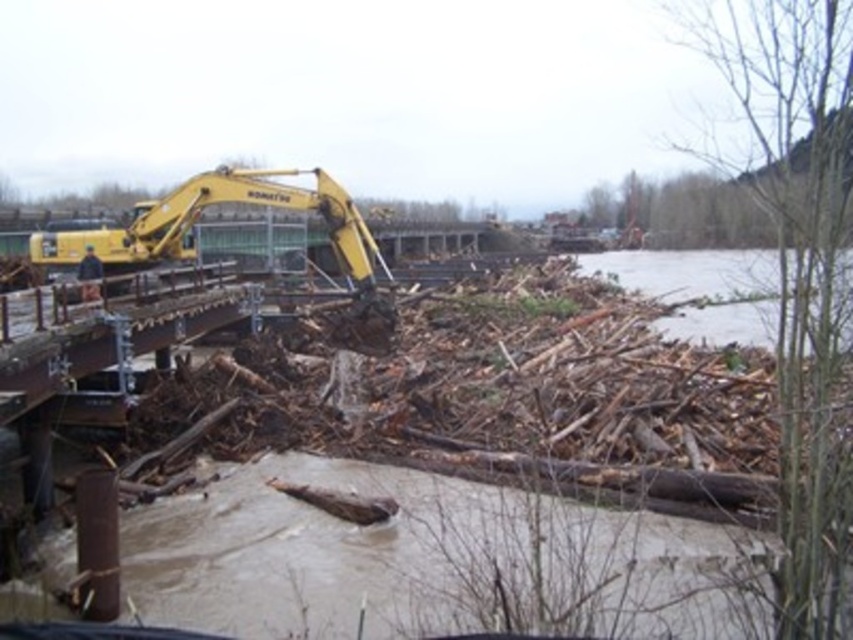
Question: Which point appears farthest from the camera in this image?

Choices:
 (A) (744, 321)
 (B) (386, 438)

Answer: (A)

Question: Does yellow rubber excavator at upper left have a smaller size compared to yellow metallic excavator at upper left?

Choices:
 (A) no
 (B) yes

Answer: (A)

Question: Among these points, which one is nearest to the camera?

Choices:
 (A) (653, 262)
 (B) (115, 250)

Answer: (B)

Question: Is yellow rubber excavator at upper left to the right of yellow metallic excavator at upper left from the viewer's perspective?

Choices:
 (A) no
 (B) yes

Answer: (B)

Question: Does yellow rubber excavator at upper left appear on the left side of brown muddy water at lower right?

Choices:
 (A) no
 (B) yes

Answer: (B)

Question: Which point is farther from the camera taking this photo?

Choices:
 (A) (704, 316)
 (B) (480, 429)

Answer: (A)